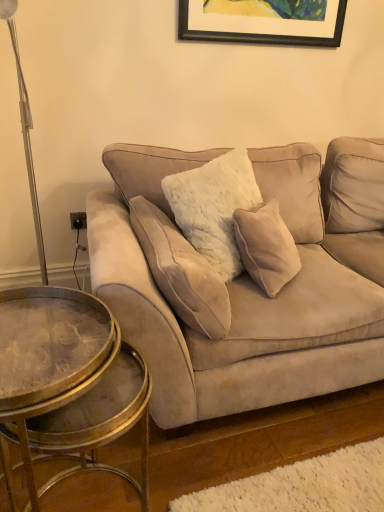
This screenshot has width=384, height=512. What do you see at coordinates (181, 272) in the screenshot?
I see `velvet beige pillow at center` at bounding box center [181, 272].

Locate an element on the screen. The image size is (384, 512). metallic glass coffee table at lower left is located at coordinates (48, 354).

Locate an element on the screen. The width and height of the screenshot is (384, 512). suede couch at center is located at coordinates (243, 285).

From the image's perspective, is velvet beige pillow at center on top of suede couch at center?

No, from the image's perspective, velvet beige pillow at center is not over suede couch at center.

Which object is positioned more to the left, velvet beige pillow at center or suede couch at center?

velvet beige pillow at center.

Based on their sizes in the image, would you say velvet beige pillow at center is bigger or smaller than suede couch at center?

In the image, velvet beige pillow at center appears to be smaller than suede couch at center.

Between velvet beige pillow at center and metallic glass coffee table at lower left, which one is positioned behind?

velvet beige pillow at center is further away from the camera.

From a real-world perspective, is velvet beige pillow at center on top of metallic glass coffee table at lower left?

Yes.

In order to click on coffee table located in front of the velvet beige pillow at center in this screenshot , I will do 48,354.

Is velvet beige pillow at center facing away from metallic glass coffee table at lower left?

Absolutely, velvet beige pillow at center is directed away from metallic glass coffee table at lower left.

Looking at this image, is suede couch at center aimed at metallic glass coffee table at lower left?

No, suede couch at center is not facing towards metallic glass coffee table at lower left.

Can you confirm if suede couch at center is thinner than metallic glass coffee table at lower left?

No, suede couch at center is not thinner than metallic glass coffee table at lower left.

Which of these two, suede couch at center or metallic glass coffee table at lower left, is smaller?

With smaller size is metallic glass coffee table at lower left.

Is point (376, 268) closer or farther from the camera than point (29, 291)?

Point (376, 268) appears to be farther away from the viewer than point (29, 291).

Between metallic glass coffee table at lower left and suede couch at center, which one has smaller size?

metallic glass coffee table at lower left.

Considering the sizes of metallic glass coffee table at lower left and suede couch at center in the image, is metallic glass coffee table at lower left wider or thinner than suede couch at center?

Considering their sizes, metallic glass coffee table at lower left looks slimmer than suede couch at center.

Where is `coffee table below the velvet beige pillow at center (from a real-world perspective)`? The image size is (384, 512). coffee table below the velvet beige pillow at center (from a real-world perspective) is located at coordinates (48, 354).

Does metallic glass coffee table at lower left turn towards velvet beige pillow at center?

No.

Can you confirm if metallic glass coffee table at lower left is positioned to the left of velvet beige pillow at center?

Indeed, metallic glass coffee table at lower left is positioned on the left side of velvet beige pillow at center.

In the image, is metallic glass coffee table at lower left positioned in front of or behind velvet beige pillow at center?

metallic glass coffee table at lower left is in front of velvet beige pillow at center.

Is suede couch at center not near velvet beige pillow at center?

They are positioned close to each other.

Consider the image. How many degrees apart are the facing directions of suede couch at center and velvet beige pillow at center?

88.1 degrees separate the facing orientations of suede couch at center and velvet beige pillow at center.

Can you confirm if suede couch at center is smaller than velvet beige pillow at center?

Actually, suede couch at center might be larger than velvet beige pillow at center.

Identify the location of pillow behind the suede couch at center. This screenshot has height=512, width=384. (181, 272).

There is a metallic glass coffee table at lower left. Identify the location of pillow above it (from a real-world perspective). (181, 272).

Considering their positions, is suede couch at center positioned further to velvet beige pillow at center than metallic glass coffee table at lower left?

Among the two, metallic glass coffee table at lower left is located further to velvet beige pillow at center.

When comparing their distances from velvet beige pillow at center, does metallic glass coffee table at lower left or suede couch at center seem closer?

The object closer to velvet beige pillow at center is suede couch at center.

Based on their spatial positions, is velvet beige pillow at center or metallic glass coffee table at lower left closer to suede couch at center?

velvet beige pillow at center is closer to suede couch at center.

Which object lies nearer to the anchor point metallic glass coffee table at lower left, suede couch at center or velvet beige pillow at center?

velvet beige pillow at center is closer to metallic glass coffee table at lower left.

From the image, which object appears to be farther from suede couch at center, metallic glass coffee table at lower left or velvet beige pillow at center?

The object further to suede couch at center is metallic glass coffee table at lower left.

Consider the image. Based on their spatial positions, is velvet beige pillow at center or suede couch at center further from metallic glass coffee table at lower left?

suede couch at center.

You are a GUI agent. You are given a task and a screenshot of the screen. Output one action in this format:
    pyautogui.click(x=<x>, y=<y>)
    Task: Click on the pillow between metallic glass coffee table at lower left and suede couch at center from left to right
    
    Given the screenshot: What is the action you would take?
    pyautogui.click(x=181, y=272)